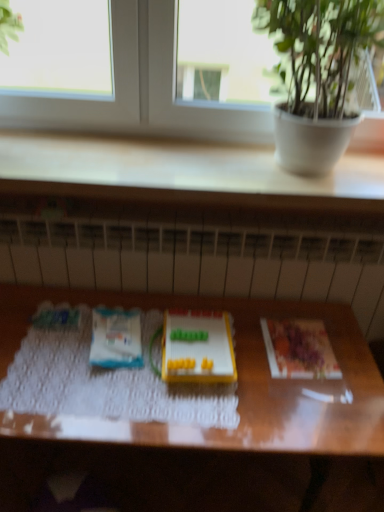
I want to click on unoccupied space behind printed paper at right, which appears as the first paperback book when viewed from the right, so click(x=287, y=307).